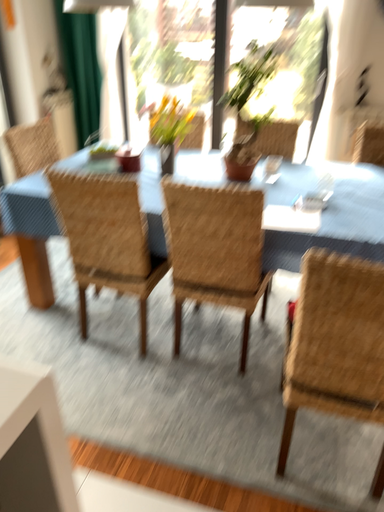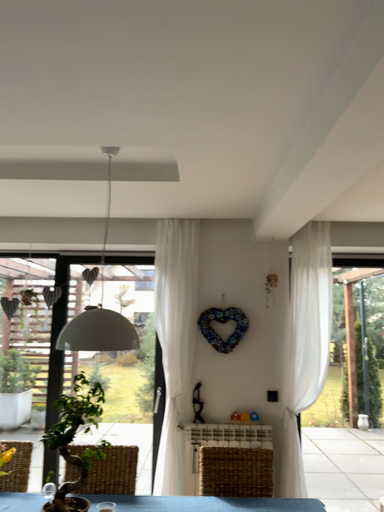
Question: How did the camera likely rotate when shooting the video?

Choices:
 (A) rotated right
 (B) rotated left

Answer: (A)